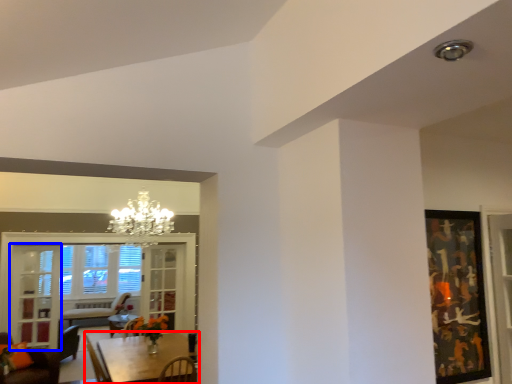
Question: Which object is closer to the camera taking this photo, table (highlighted by a red box) or glass door (highlighted by a blue box)?

Choices:
 (A) table
 (B) glass door

Answer: (A)